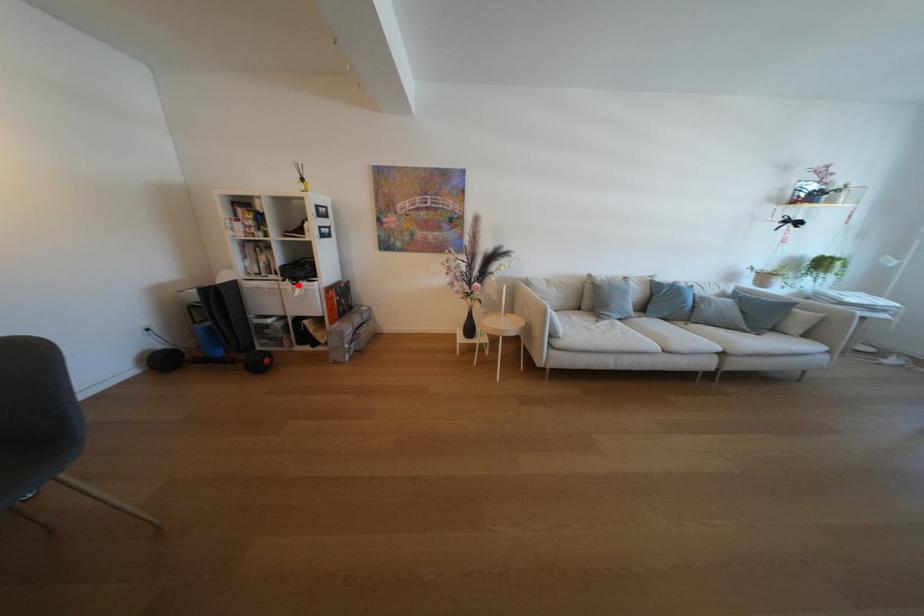
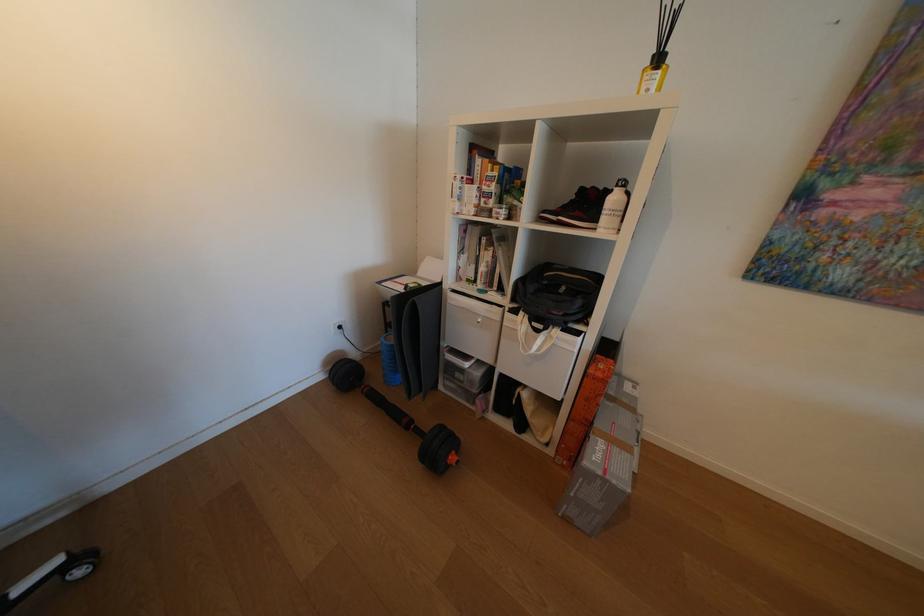
In the second image, find the point that corresponds to the highlighted location in the first image.

(531, 325)